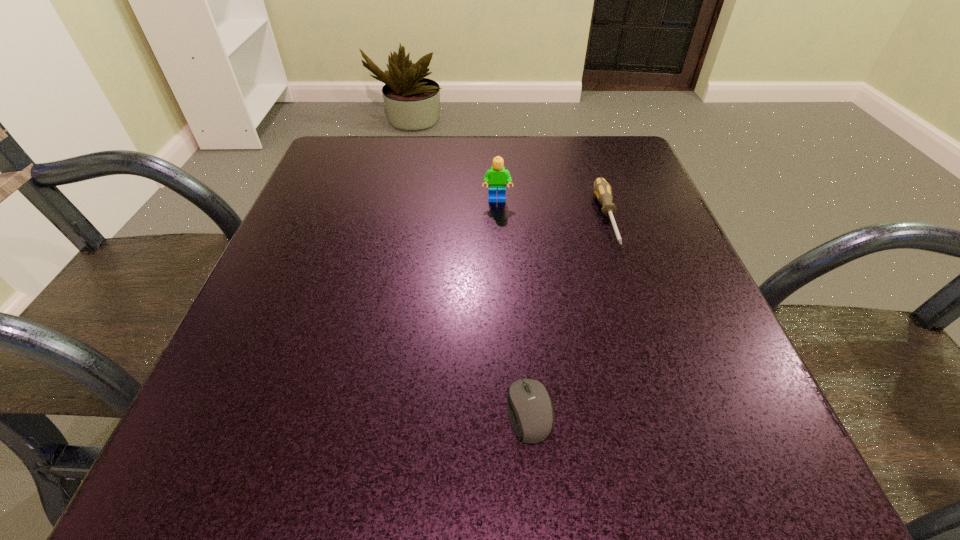
This screenshot has width=960, height=540. I want to click on vacant area that lies between the screwdriver and the Lego, so click(x=552, y=209).

Find the location of `vacant space that is in between the shortest object and the rightmost object`. vacant space that is in between the shortest object and the rightmost object is located at coordinates (568, 314).

Image resolution: width=960 pixels, height=540 pixels. What are the coordinates of `empty location between the rightmost object and the Lego` in the screenshot? It's located at (552, 209).

Where is `free space between the screwdriver and the shortest object`? free space between the screwdriver and the shortest object is located at coordinates (568, 314).

At what (x,y) coordinates should I click in order to perform the action: click on vacant area that lies between the screwdriver and the Lego. Please return your answer as a coordinate pair (x, y). Image resolution: width=960 pixels, height=540 pixels. Looking at the image, I should click on (552, 209).

Find the location of a particular element. The height and width of the screenshot is (540, 960). empty location between the Lego and the computer equipment is located at coordinates (514, 306).

You are a GUI agent. You are given a task and a screenshot of the screen. Output one action in this format:
    pyautogui.click(x=<x>, y=<y>)
    Task: Click on the vacant area that lies between the shortest object and the Lego
    The height and width of the screenshot is (540, 960).
    Given the screenshot: What is the action you would take?
    click(514, 306)

The image size is (960, 540). Identify the location of vacant space that's between the tallest object and the shortest object. (514, 306).

Identify the location of free space between the tallest object and the second tallest object. The image size is (960, 540). (552, 209).

The image size is (960, 540). I want to click on the second closest object to the shortest object, so click(497, 177).